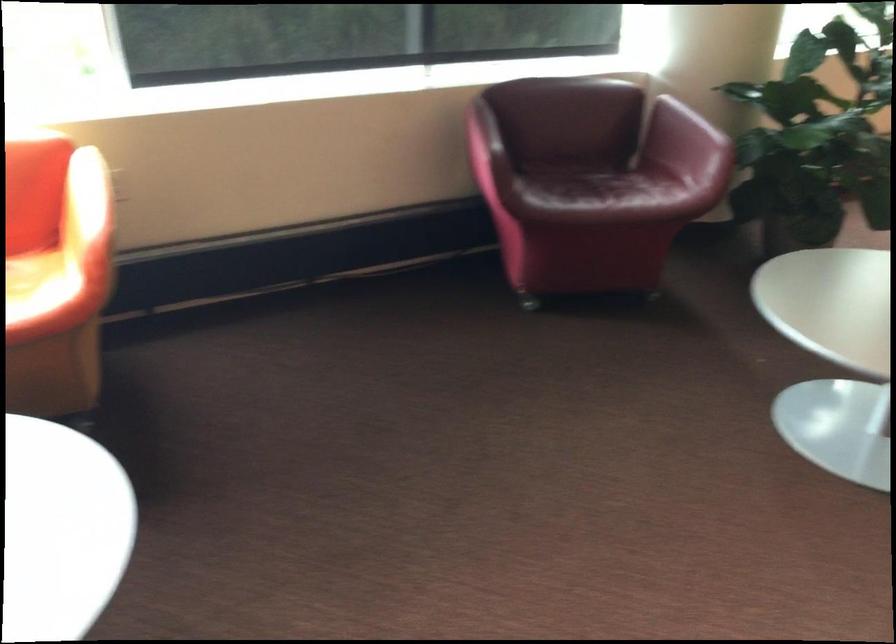
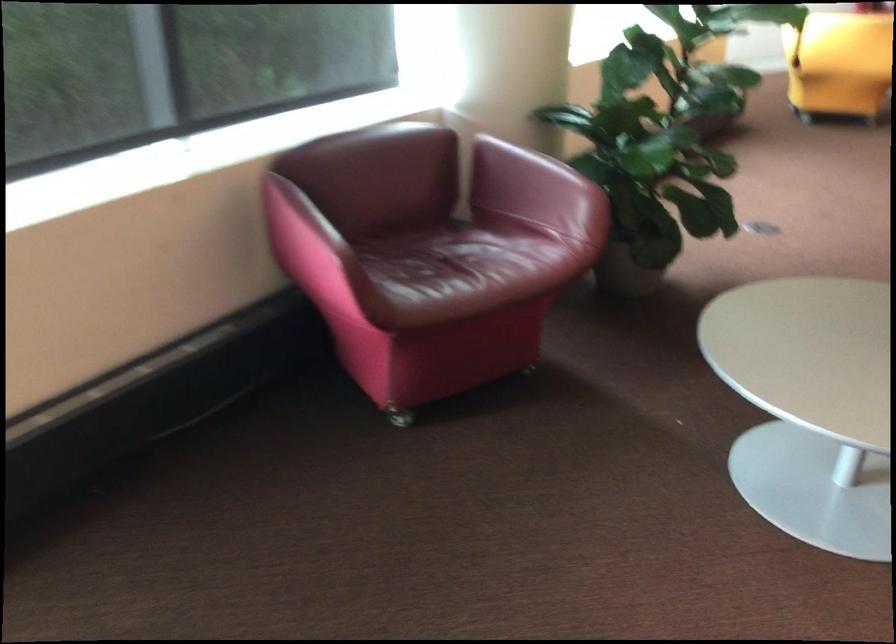
Find the pixel in the second image that matches point 597,187 in the first image.

(466, 266)